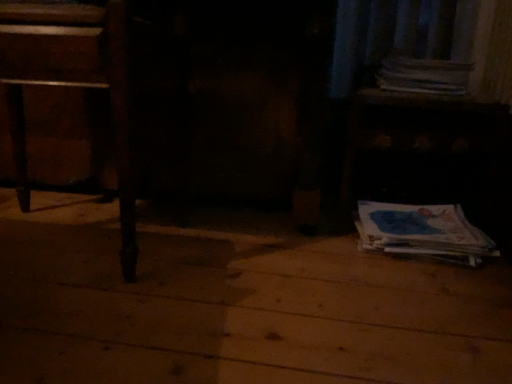
Identify the location of free space to the left of blue paper at lower right, the first paperback book ordered from the bottom. The height and width of the screenshot is (384, 512). (309, 251).